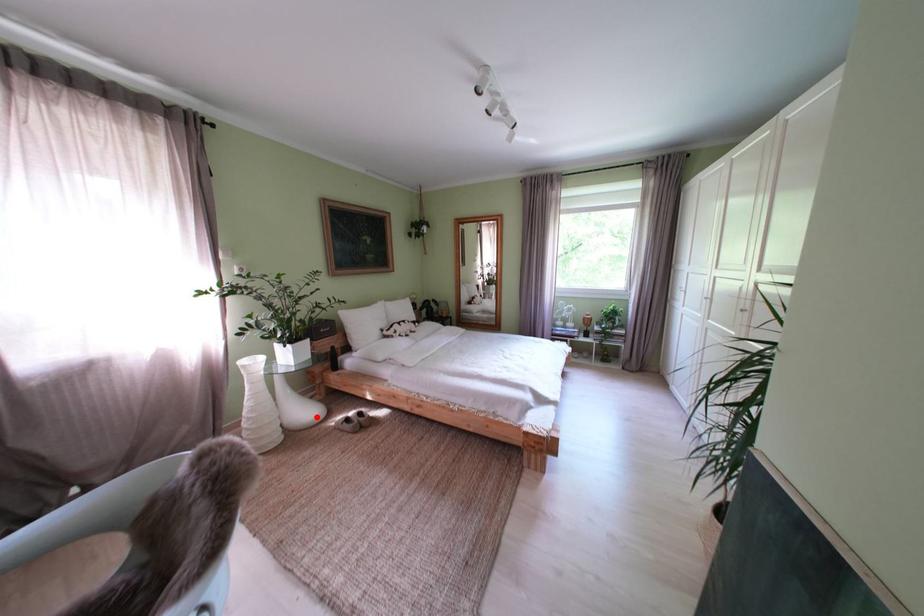
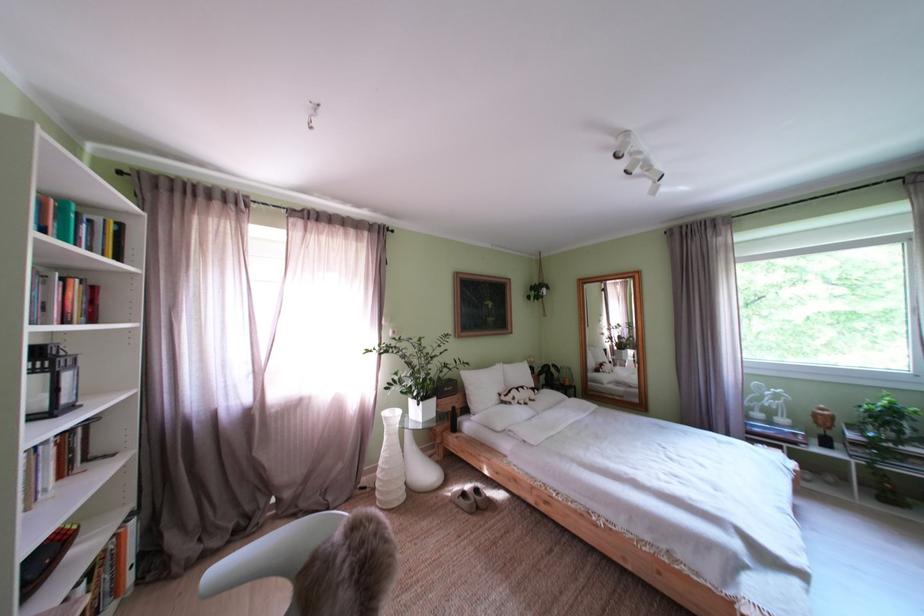
Where in the second image is the point corresponding to the highlighted location from the first image?

(438, 479)